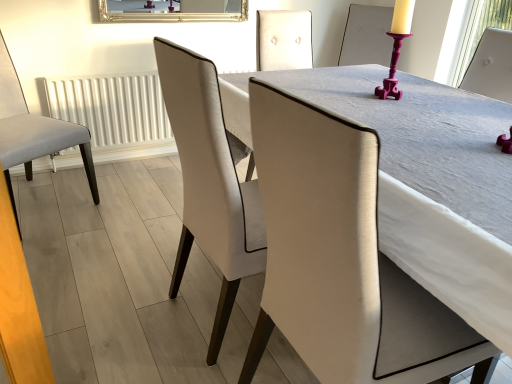
Question: Is light gray fabric chair at left, the second chair viewed from the right, behind white textured radiator at left?

Choices:
 (A) yes
 (B) no

Answer: (B)

Question: Is light gray fabric chair at left, the first chair viewed from the left, wider than white textured radiator at left?

Choices:
 (A) no
 (B) yes

Answer: (B)

Question: Considering the relative sizes of light gray fabric chair at left, the second chair viewed from the right, and white textured radiator at left in the image provided, is light gray fabric chair at left, the second chair viewed from the right, bigger than white textured radiator at left?

Choices:
 (A) no
 (B) yes

Answer: (B)

Question: Is light gray fabric chair at left, the second chair viewed from the right, positioned with its back to white textured radiator at left?

Choices:
 (A) no
 (B) yes

Answer: (A)

Question: Does light gray fabric chair at left, the second chair viewed from the right, have a smaller size compared to white textured radiator at left?

Choices:
 (A) no
 (B) yes

Answer: (A)

Question: From the image's perspective, is light gray fabric chair at left, the second chair viewed from the right, located above white textured radiator at left?

Choices:
 (A) no
 (B) yes

Answer: (A)

Question: Is white textured radiator at left at the right side of matte white chair at center, which is the 2th chair in left-to-right order?

Choices:
 (A) yes
 (B) no

Answer: (B)

Question: Does white textured radiator at left have a smaller size compared to matte white chair at center, which ranks as the 1th chair in right-to-left order?

Choices:
 (A) no
 (B) yes

Answer: (B)

Question: Is white textured radiator at left at the left side of matte white chair at center, which is the 2th chair in left-to-right order?

Choices:
 (A) yes
 (B) no

Answer: (A)

Question: Can matte white chair at center, which is the 2th chair in left-to-right order, be found inside white textured radiator at left?

Choices:
 (A) no
 (B) yes

Answer: (A)

Question: Does white textured radiator at left have a lesser height compared to matte white chair at center, which ranks as the 1th chair in right-to-left order?

Choices:
 (A) no
 (B) yes

Answer: (B)

Question: From a real-world perspective, is white textured radiator at left below matte white chair at center, which is the 2th chair in left-to-right order?

Choices:
 (A) no
 (B) yes

Answer: (B)

Question: Is gold-framed mirror at upper center facing away from white textured radiator at left?

Choices:
 (A) no
 (B) yes

Answer: (A)